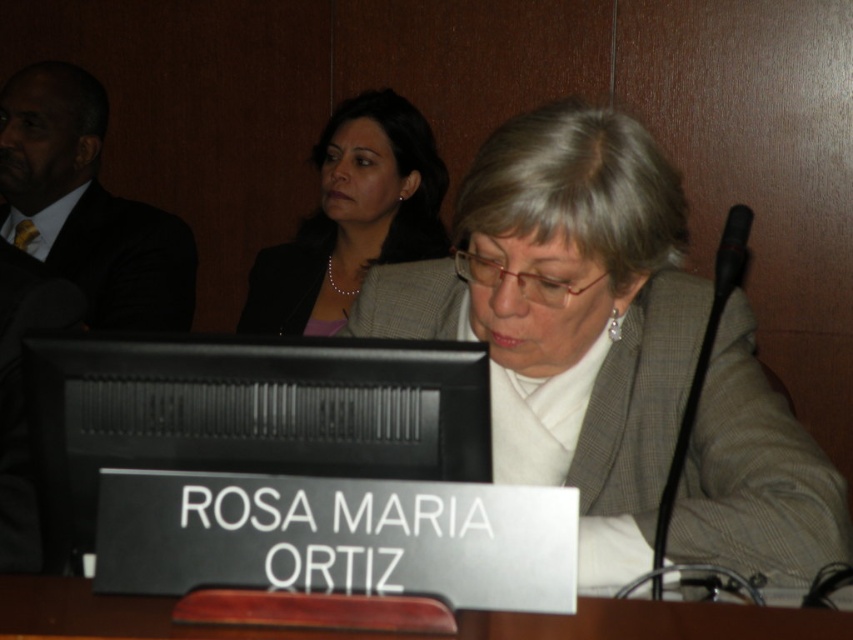
Question: Which point is farther to the camera?

Choices:
 (A) matte gray blazer at center
 (B) brown wood table at center
 (C) matte black suit at left
 (D) black textured blazer at upper center

Answer: (C)

Question: Where is brown wood table at center located in relation to black textured blazer at upper center in the image?

Choices:
 (A) below
 (B) above

Answer: (A)

Question: Does matte black blazer at upper center have a lesser width compared to brown wood table at center?

Choices:
 (A) yes
 (B) no

Answer: (A)

Question: Can you confirm if matte gray blazer at center is smaller than matte black suit at left?

Choices:
 (A) yes
 (B) no

Answer: (B)

Question: Which point is closer to the camera taking this photo?

Choices:
 (A) (425, 144)
 (B) (103, 192)
 (C) (285, 284)
 (D) (756, 419)

Answer: (D)

Question: Estimate the real-world distances between objects in this image. Which object is farther from the matte black suit at left?

Choices:
 (A) brown wood table at center
 (B) matte black blazer at upper center
 (C) black textured blazer at upper center
 (D) matte gray blazer at center

Answer: (A)